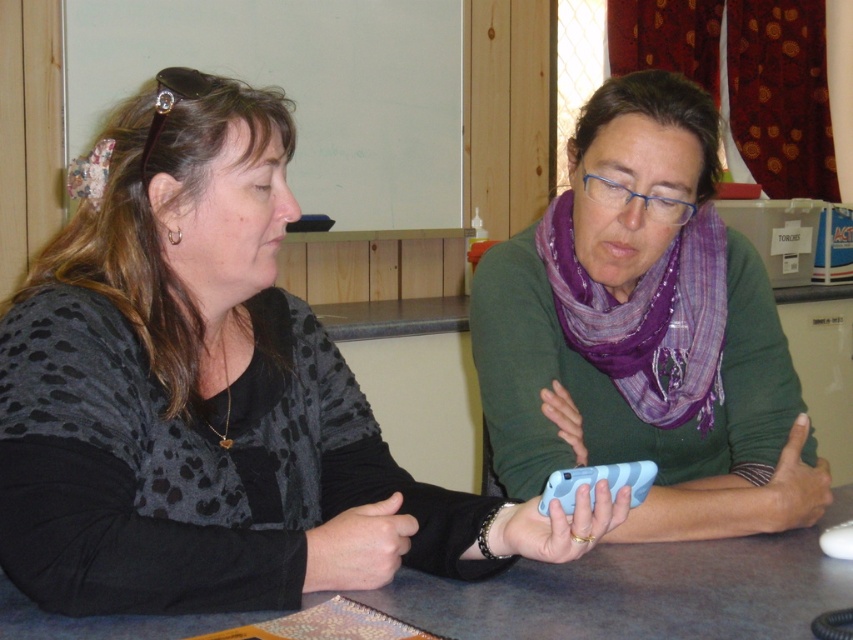
Question: Which is nearer to the purple scarf at center?

Choices:
 (A) matte black sweater at center
 (B) blue plastic phone at center

Answer: (B)

Question: Can you confirm if purple scarf at center is positioned to the right of blue plastic phone at center?

Choices:
 (A) no
 (B) yes

Answer: (B)

Question: Does purple scarf at center appear over blue plastic phone at center?

Choices:
 (A) yes
 (B) no

Answer: (A)

Question: Which object is the farthest from the purple scarf at center?

Choices:
 (A) blue plastic phone at center
 (B) matte black sweater at center

Answer: (B)

Question: Which point is closer to the camera taking this photo?

Choices:
 (A) (679, 381)
 (B) (788, 540)

Answer: (B)

Question: Considering the relative positions of matte black sweater at center and purple scarf at center in the image provided, where is matte black sweater at center located with respect to purple scarf at center?

Choices:
 (A) left
 (B) right

Answer: (A)